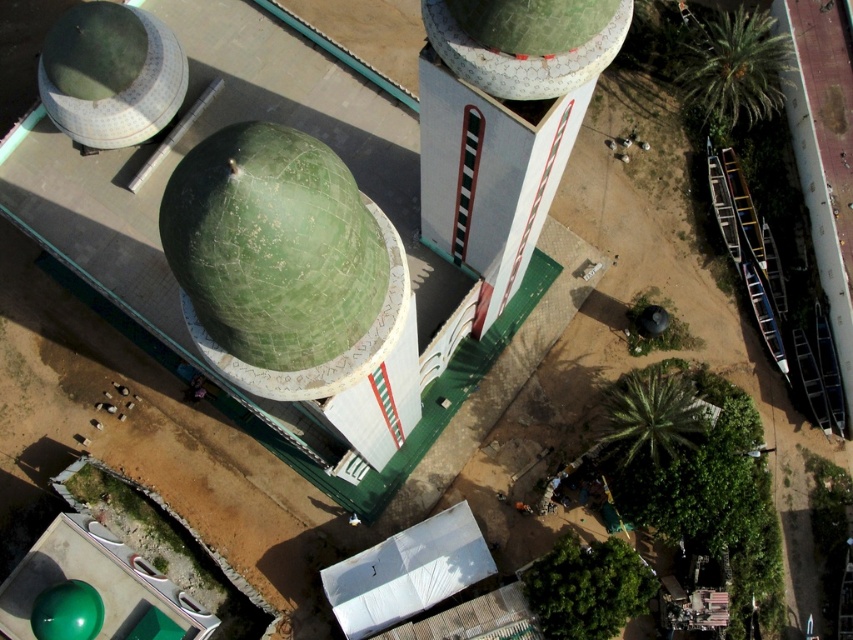
You are a drone operator tasked with capturing aerial footage of the mosque complex. You need to fly between the two domes to ensure the drone stays within the complex. Given the distance between them, what is the minimum distance the drone must maintain between the green matte dome at center and the green textured dome at upper center during its flight?

The minimum distance the drone must maintain between the green matte dome at center and the green textured dome at upper center is 13.87 meters, as they are 13.87 meters apart from each other.

You are a drone operator flying a drone that is 1.2 meters wide. You need to fly between the green matte dome at center and the green textured dome at upper center. Can your drone pass through the space between them horizontally?

The green matte dome at center is taller than the green textured dome at upper center. Since the drone is 1.2 meters wide, the horizontal space between the domes must be checked. However, the description only provides information about their vertical height difference, not the horizontal distance between them. Therefore, it is impossible to determine if the drone can pass through based on the given information.